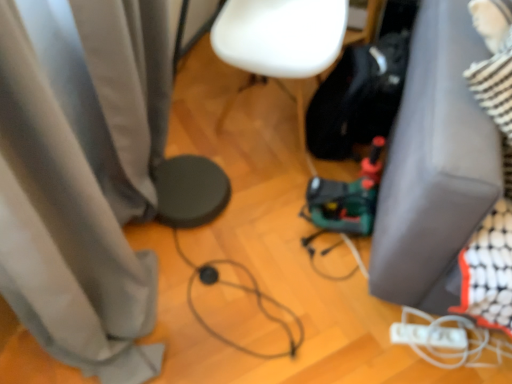
At what (x,y) coordinates should I click in order to perform the action: click on free space to the right of white matte wii controller at lower right. Please return your answer as a coordinate pair (x, y). Looking at the image, I should click on (475, 361).